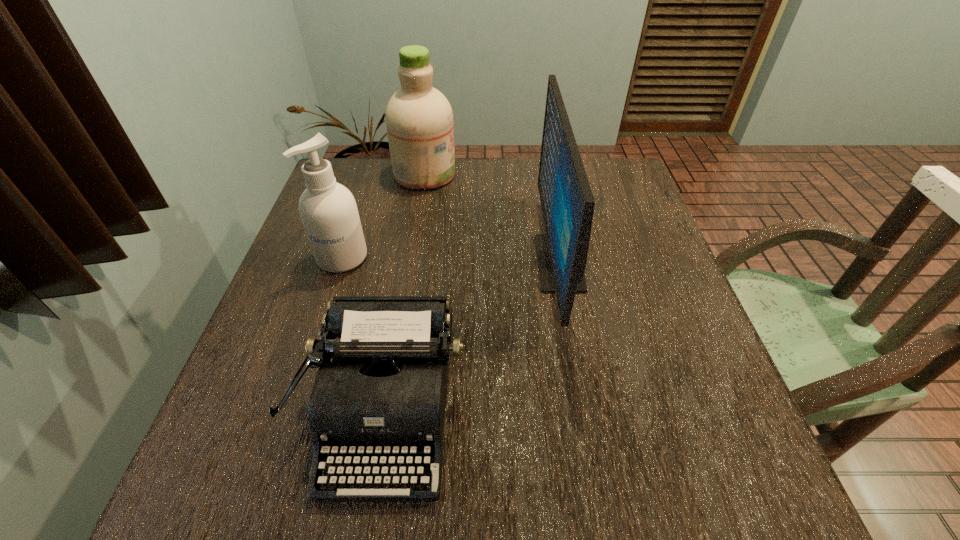
In order to click on free region at the right edge of the desktop in this screenshot , I will do `click(651, 237)`.

The width and height of the screenshot is (960, 540). Find the location of `free space at the far right corner`. free space at the far right corner is located at coordinates (629, 197).

I want to click on blank space at the near right corner of the desktop, so tap(673, 488).

The image size is (960, 540). What are the coordinates of `vacant area between the shortest object and the right cleansing agent` in the screenshot? It's located at click(405, 294).

Find the location of a particular element. free space between the typewriter and the computer monitor is located at coordinates (472, 338).

Find the location of a particular element. This screenshot has width=960, height=540. free space between the shortest object and the farthest object is located at coordinates (405, 294).

The height and width of the screenshot is (540, 960). Find the location of `blank region between the right cleansing agent and the shortest object`. blank region between the right cleansing agent and the shortest object is located at coordinates (405, 294).

I want to click on unoccupied area between the shortest object and the rightmost object, so click(x=472, y=338).

Locate an element on the screen. This screenshot has height=540, width=960. free spot between the farthest object and the shortest object is located at coordinates (405, 294).

This screenshot has width=960, height=540. What are the coordinates of `empty space between the shortest object and the right cleansing agent` in the screenshot? It's located at (405, 294).